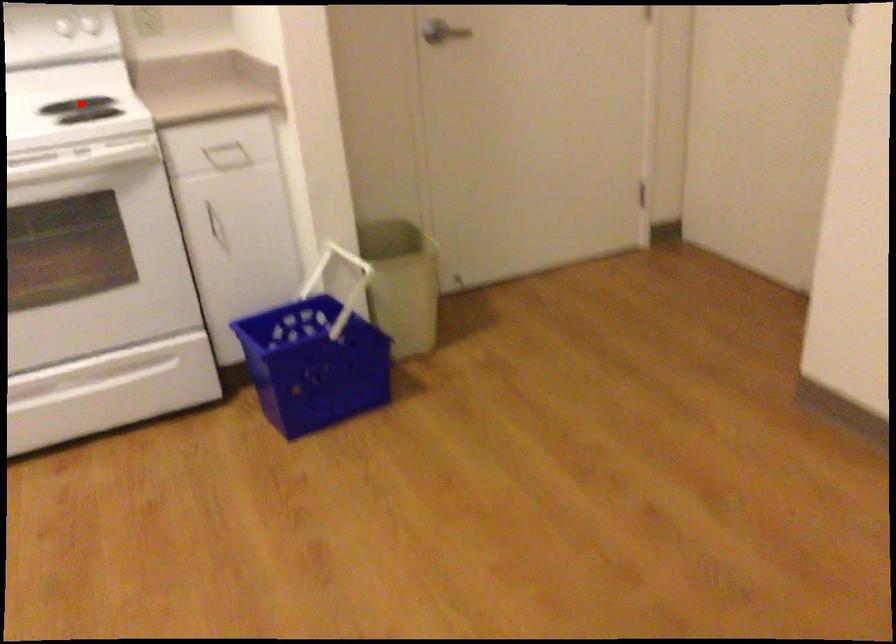
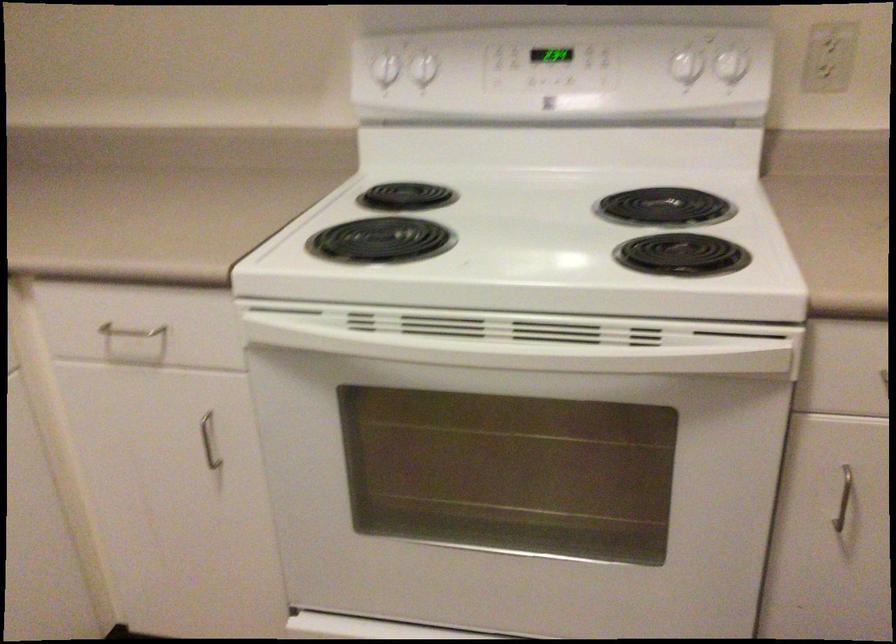
Locate, in the second image, the point that corresponds to the highlighted location in the first image.

(664, 207)